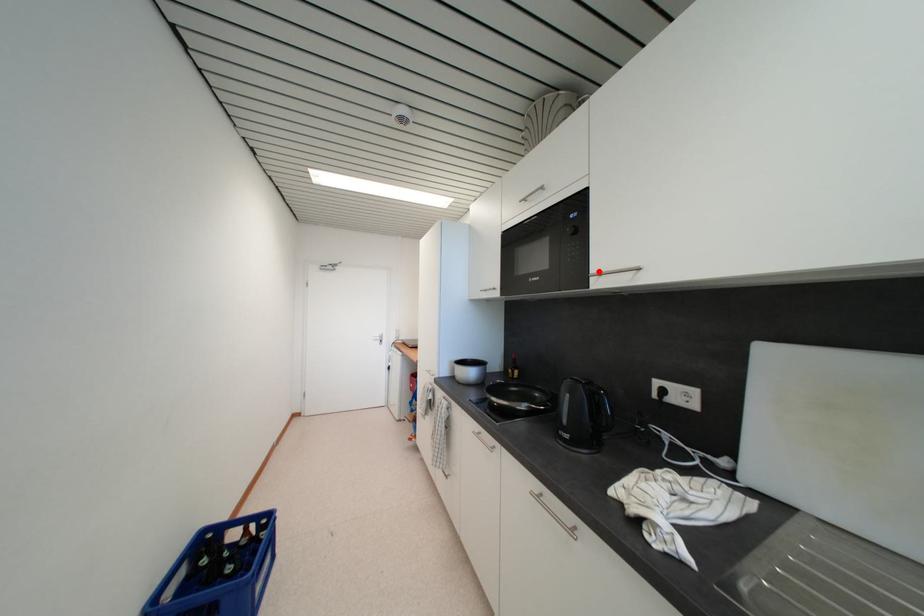
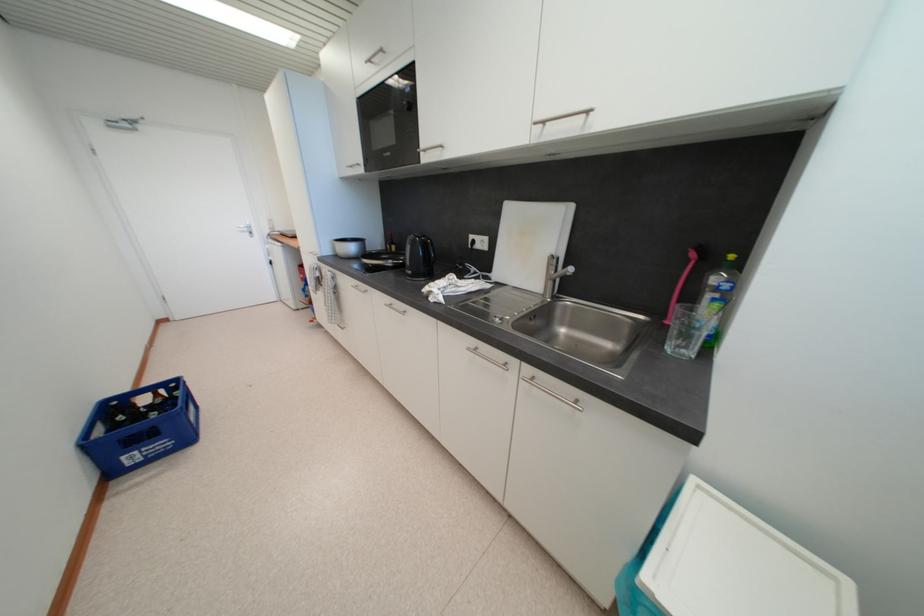
Locate, in the second image, the point that corresponds to the highlighted location in the first image.

(428, 148)